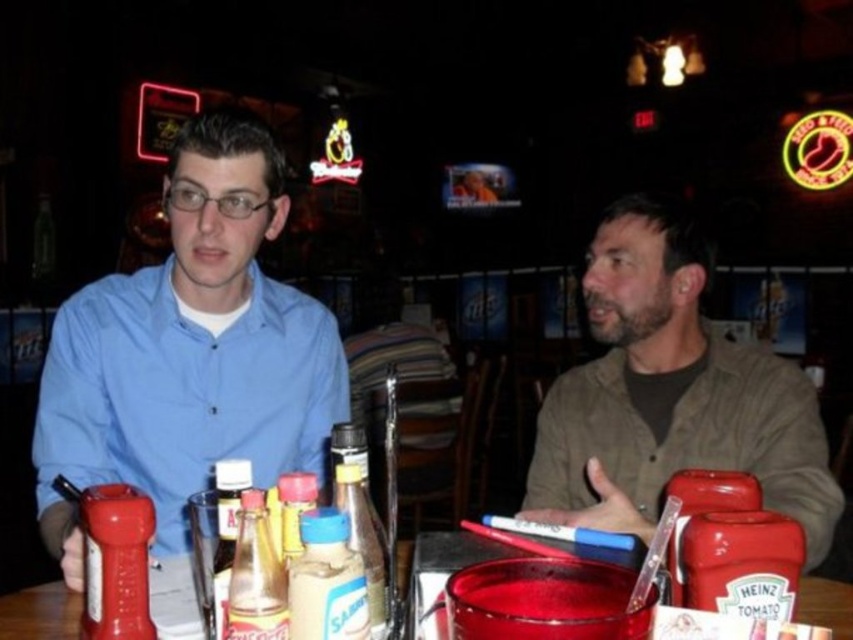
Does matte blue shirt at left have a greater width compared to brown textured shirt at right?

In fact, matte blue shirt at left might be narrower than brown textured shirt at right.

Consider the image. Who is lower down, matte blue shirt at left or brown textured shirt at right?

matte blue shirt at left

Where is `matte blue shirt at left`? matte blue shirt at left is located at coordinates (189, 349).

Find the location of a particular element. The height and width of the screenshot is (640, 853). matte blue shirt at left is located at coordinates (189, 349).

Between matte blue shirt at left and translucent plastic cup at center, which one has less height?

Standing shorter between the two is translucent plastic cup at center.

Can you confirm if matte blue shirt at left is positioned to the left of translucent plastic cup at center?

No, matte blue shirt at left is not to the left of translucent plastic cup at center.

Identify the location of matte blue shirt at left. This screenshot has height=640, width=853. (189, 349).

Which of these two, brown textured shirt at right or translucent plastic cup at center, stands taller?

brown textured shirt at right

Does brown textured shirt at right have a larger size compared to translucent plastic cup at center?

Yes, brown textured shirt at right is bigger than translucent plastic cup at center.

Which is behind, point (624, 285) or point (53, 598)?

Positioned behind is point (624, 285).

You are a GUI agent. You are given a task and a screenshot of the screen. Output one action in this format:
    pyautogui.click(x=<x>, y=<y>)
    Task: Click on the brown textured shirt at right
    
    Given the screenshot: What is the action you would take?
    pyautogui.click(x=670, y=394)